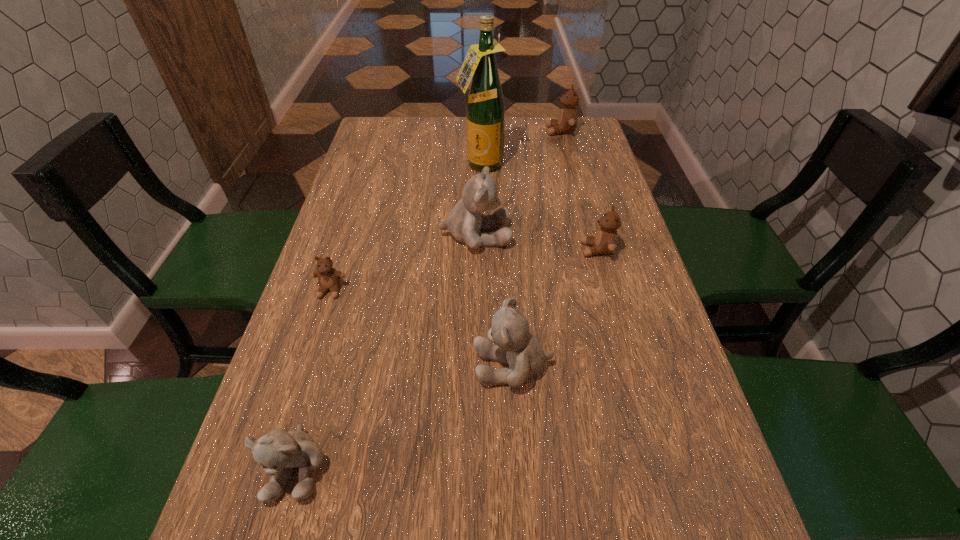
The image size is (960, 540). What are the coordinates of `the sixth nearest object` in the screenshot? It's located at (485, 109).

You are a GUI agent. You are given a task and a screenshot of the screen. Output one action in this format:
    pyautogui.click(x=<x>, y=<y>)
    Task: Click on the liquor
    This screenshot has height=540, width=960.
    Given the screenshot: What is the action you would take?
    pyautogui.click(x=485, y=109)

Find the location of a particular element. Image resolution: width=960 pixels, height=540 pixels. the biggest gray teddy bear is located at coordinates (465, 222).

Find the location of `the tallest teddy bear`. the tallest teddy bear is located at coordinates (465, 222).

This screenshot has width=960, height=540. Find the location of `the biggest brown teddy bear`. the biggest brown teddy bear is located at coordinates (567, 121).

You are a GUI agent. You are given a task and a screenshot of the screen. Output one action in this format:
    pyautogui.click(x=<x>, y=<y>)
    Task: Click on the farthest object
    The width and height of the screenshot is (960, 540).
    Given the screenshot: What is the action you would take?
    pyautogui.click(x=567, y=121)

You are a GUI agent. You are given a task and a screenshot of the screen. Output one action in this format:
    pyautogui.click(x=<x>, y=<y>)
    Task: Click on the second farthest gray teddy bear
    
    Given the screenshot: What is the action you would take?
    pyautogui.click(x=514, y=345)

This screenshot has width=960, height=540. I want to click on the second nearest teddy bear, so click(x=514, y=345).

Find the location of a particular element. This screenshot has width=960, height=540. the second smallest brown teddy bear is located at coordinates (606, 239).

Where is `the leftmost gray teddy bear`? the leftmost gray teddy bear is located at coordinates (277, 451).